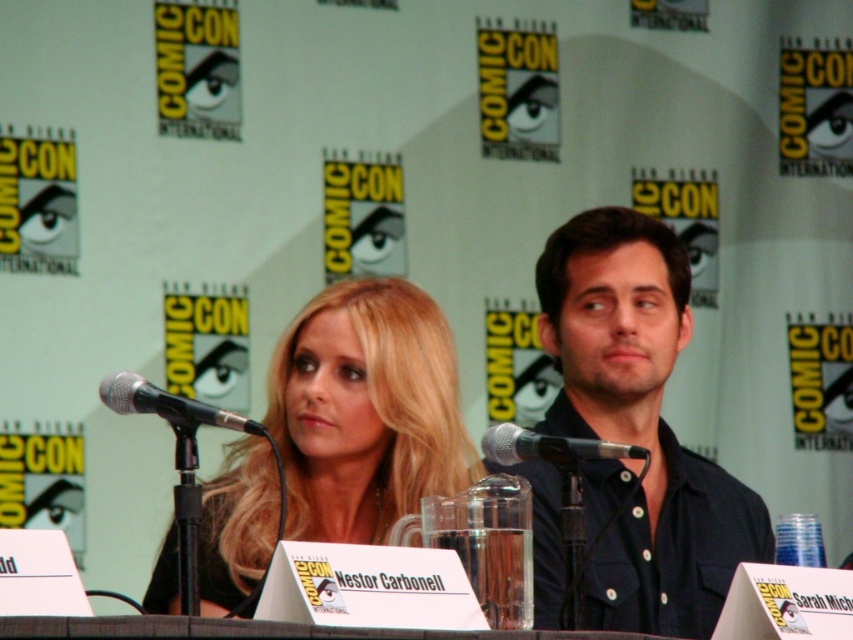
You are a photographer at Comic Con who wants to take a photo of the panelists. You need to position your camera so that the blonde hair at center is centered in the frame. What coordinates should you aim for?

The blonde hair at center is located at coordinates point [364,412], so you should aim your camera at those coordinates to center it in the frame.